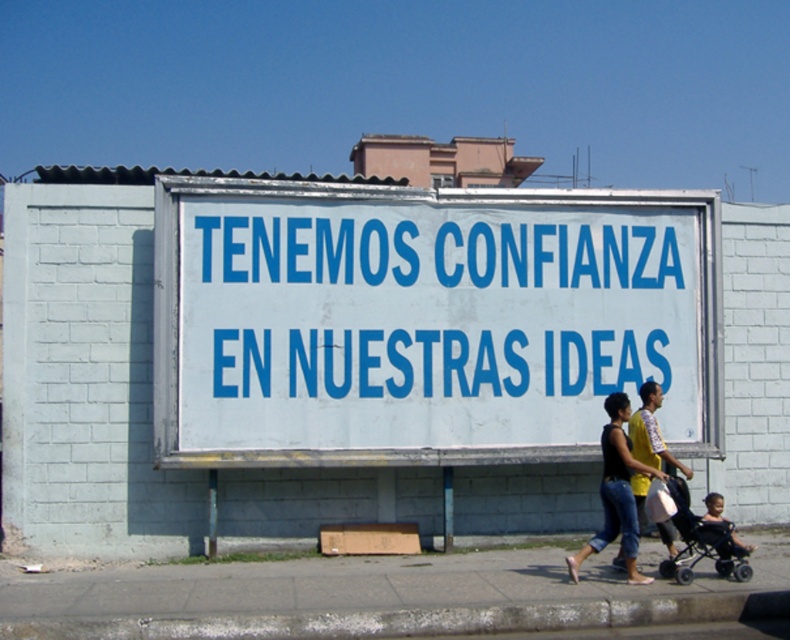
Who is more distant from viewer, [668,230] or [611,465]?

The point [668,230] is more distant.

Can you confirm if white paperboard sign at center is positioned below black denim jeans at lower right?

Actually, white paperboard sign at center is above black denim jeans at lower right.

Between point (401, 275) and point (623, 420), which one is positioned in front?

Point (623, 420) is more forward.

Where is `white paperboard sign at center`? This screenshot has height=640, width=790. white paperboard sign at center is located at coordinates (424, 321).

Between black denim jeans at lower right and black plastic baby carriage at lower right, which one appears on the right side from the viewer's perspective?

Positioned to the right is black plastic baby carriage at lower right.

Measure the distance between black denim jeans at lower right and black plastic baby carriage at lower right.

16.94 inches

Is point (627, 509) positioned after point (713, 554)?

No, it is in front of (713, 554).

I want to click on black denim jeans at lower right, so click(x=615, y=492).

Between white paperboard sign at center and black plastic baby carriage at lower right, which one appears on the left side from the viewer's perspective?

Positioned to the left is white paperboard sign at center.

Consider the image. Is white paperboard sign at center to the right of black plastic baby carriage at lower right from the viewer's perspective?

Incorrect, white paperboard sign at center is not on the right side of black plastic baby carriage at lower right.

Who is more forward, (x=407, y=317) or (x=698, y=547)?

Point (x=698, y=547) is in front.

At what (x,y) coordinates should I click in order to perform the action: click on white paperboard sign at center. Please return your answer as a coordinate pair (x, y). Image resolution: width=790 pixels, height=640 pixels. Looking at the image, I should click on (424, 321).